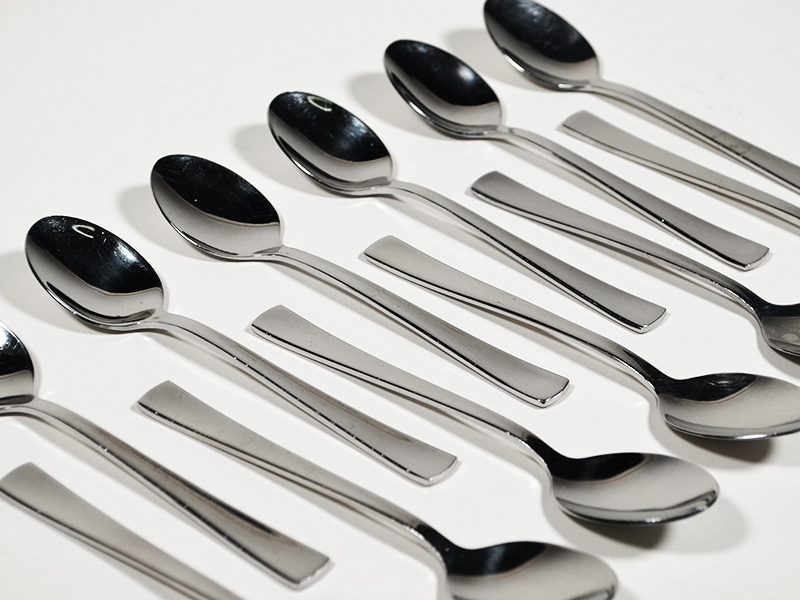
Find the location of `metal tablespoons`. metal tablespoons is located at coordinates (522, 574), (606, 498), (712, 430), (790, 324), (14, 373), (109, 265), (206, 208), (316, 135), (445, 91), (546, 49).